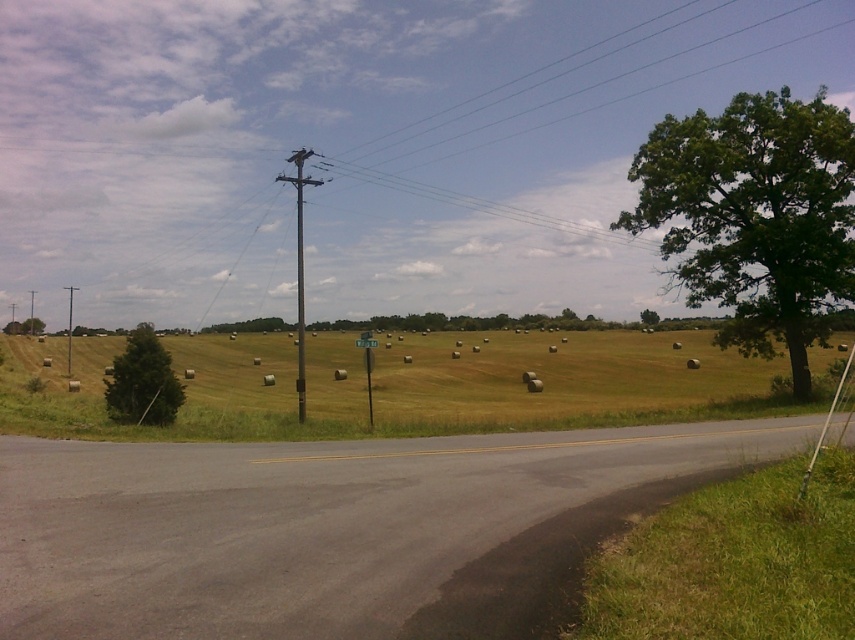
This screenshot has height=640, width=855. What do you see at coordinates (143, 381) in the screenshot? I see `green matte tree at left` at bounding box center [143, 381].

This screenshot has width=855, height=640. Identify the location of green matte tree at left. (143, 381).

Locate an element on the screen. The height and width of the screenshot is (640, 855). green matte tree at left is located at coordinates (143, 381).

From the picture: Does green matte tree at left lie behind brown wooden telegraph pole at center?

No, it is not.

Does green matte tree at left have a greater height compared to brown wooden telegraph pole at center?

Incorrect, green matte tree at left's height is not larger of brown wooden telegraph pole at center's.

The width and height of the screenshot is (855, 640). Describe the element at coordinates (143, 381) in the screenshot. I see `green matte tree at left` at that location.

At what (x,y) coordinates should I click in order to perform the action: click on green matte tree at left. Please return your answer as a coordinate pair (x, y). The image size is (855, 640). Looking at the image, I should click on (143, 381).

Who is more forward, (736, 314) or (299, 224)?

Point (736, 314) is in front.

Can you confirm if green leafy tree at upper right is positioned above brown wooden telegraph pole at center?

Correct, green leafy tree at upper right is located above brown wooden telegraph pole at center.

Which is behind, point (623, 214) or point (299, 385)?

The point (623, 214) is behind.

Where is `green leafy tree at upper right`? This screenshot has width=855, height=640. green leafy tree at upper right is located at coordinates (755, 216).